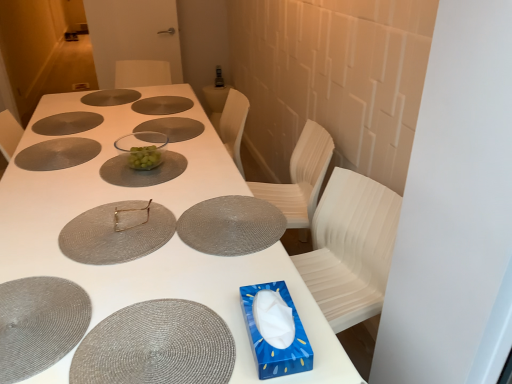
Locate an element on the screen. This screenshot has width=512, height=384. vacant area that lies between matte gray placemat at center, arranged as the second glass plate when viewed from the front, and matte gray glass plate at upper center, which is the 9th glass plate from front to back is located at coordinates (106, 147).